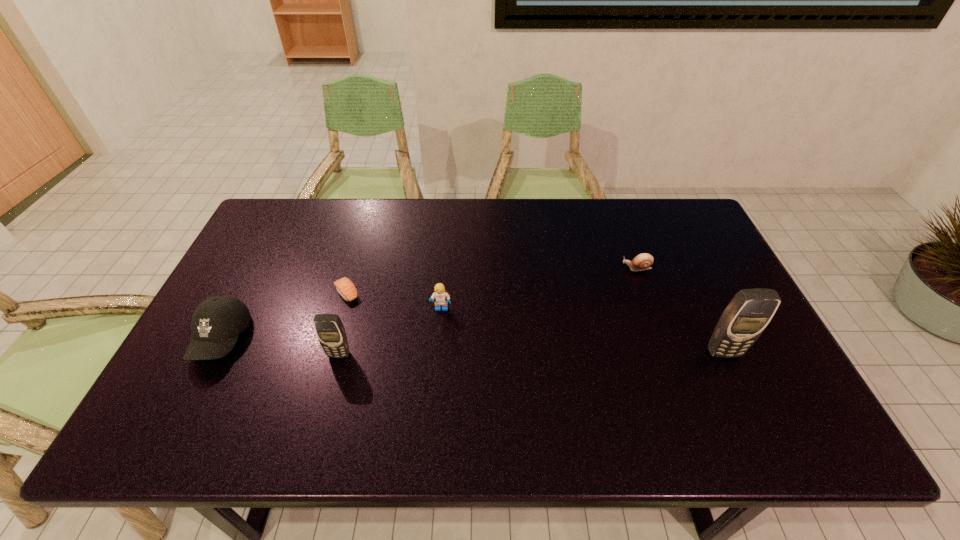
Find the location of `vacant space located 0.090m on the front face of the rightmost object`. vacant space located 0.090m on the front face of the rightmost object is located at coordinates (742, 392).

I want to click on free space located 0.310m on the front-facing side of the fifth object from left to right, so click(x=518, y=268).

Where is `vacant space located on the front-facing side of the fifth object from left to right`? The width and height of the screenshot is (960, 540). vacant space located on the front-facing side of the fifth object from left to right is located at coordinates (601, 268).

Where is `free space located 0.050m on the front-facing side of the fifth object from left to right`? This screenshot has height=540, width=960. free space located 0.050m on the front-facing side of the fifth object from left to right is located at coordinates (605, 268).

Where is `vacant space located on the front-facing side of the Lego`? vacant space located on the front-facing side of the Lego is located at coordinates (438, 356).

The height and width of the screenshot is (540, 960). Identify the location of free spot located on the front-facing side of the leftmost object. (194, 391).

Identify the location of free location located 0.360m on the right of the sushi. (486, 294).

You are a GUI agent. You are given a task and a screenshot of the screen. Output one action in this format:
    pyautogui.click(x=<x>, y=<y>)
    Task: Click on the object positioned at the near edge
    This screenshot has width=960, height=540.
    Given the screenshot: What is the action you would take?
    pyautogui.click(x=217, y=322)

Locate an element on the screen. This screenshot has height=540, width=960. object that is at the left edge is located at coordinates (217, 322).

Locate an element on the screen. Image resolution: width=960 pixels, height=540 pixels. object that is at the right edge is located at coordinates (750, 311).